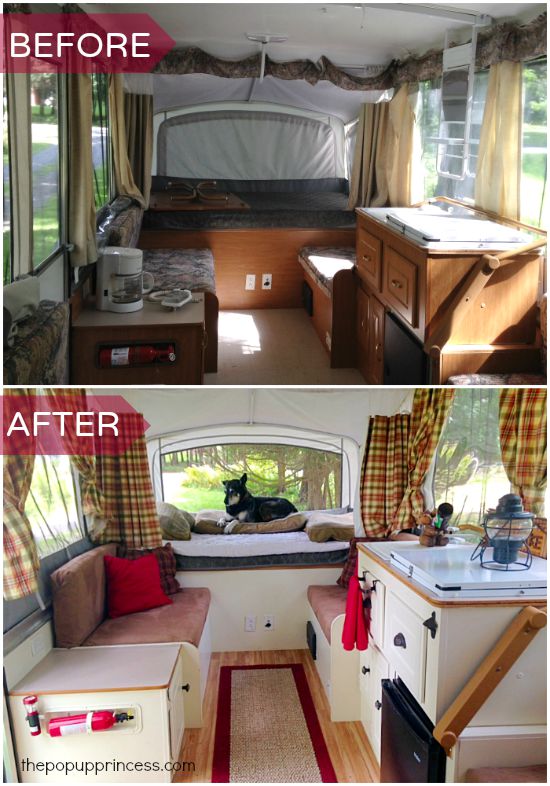
Where is `chair seat`? chair seat is located at coordinates (151, 627).